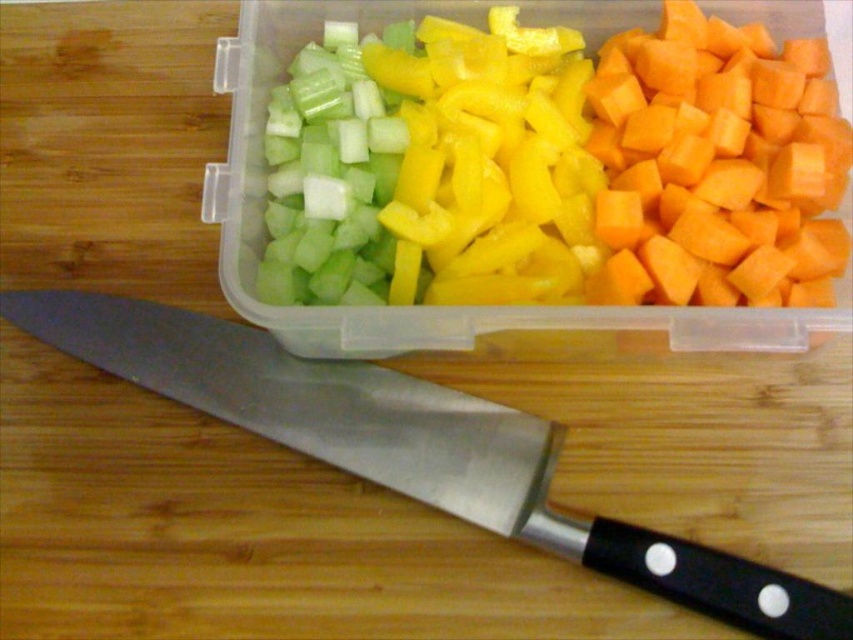
Does polished metal knife at center come in front of green translucent celery at upper left?

That is True.

Image resolution: width=853 pixels, height=640 pixels. I want to click on polished metal knife at center, so click(415, 449).

This screenshot has width=853, height=640. Find the location of `polished metal knife at center`. polished metal knife at center is located at coordinates (415, 449).

Looking at this image, who is taller, yellow matte bell pepper at center or green translucent celery at upper left?

yellow matte bell pepper at center

Is yellow matte bell pepper at center wider than green translucent celery at upper left?

Correct, the width of yellow matte bell pepper at center exceeds that of green translucent celery at upper left.

Image resolution: width=853 pixels, height=640 pixels. What are the coordinates of `yellow matte bell pepper at center` in the screenshot? It's located at (490, 163).

Can you confirm if polished metal knife at center is positioned to the left of orange matte carrot at right?

Yes, polished metal knife at center is to the left of orange matte carrot at right.

Who is shorter, polished metal knife at center or orange matte carrot at right?

polished metal knife at center is shorter.

Does point (317, 381) come farther from viewer compared to point (637, 99)?

No, it is in front of (637, 99).

This screenshot has height=640, width=853. What are the coordinates of `polished metal knife at center` in the screenshot? It's located at (415, 449).